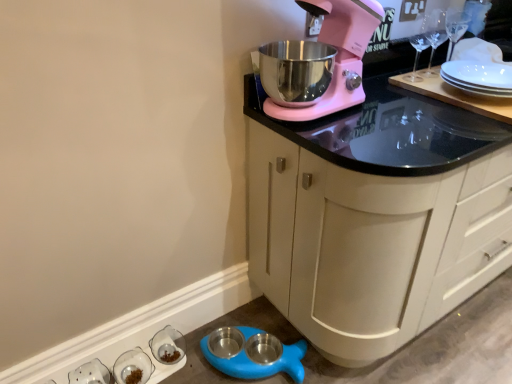
Describe the element at coordinates (90, 373) in the screenshot. I see `white glossy salt and pepper shakers at lower left, acting as the 3th tableware starting from the right` at that location.

Identify the location of matte white cabinet at upper right. The width and height of the screenshot is (512, 384). (375, 217).

You are a GUI agent. You are given a task and a screenshot of the screen. Output one action in this format:
    pyautogui.click(x=<x>, y=<y>)
    Task: Click on the pink matte mixer at upper right
    
    Given the screenshot: What is the action you would take?
    pyautogui.click(x=337, y=56)

What is the approximate width of pink matte mixer at upper right?

The width of pink matte mixer at upper right is 16.74 inches.

Describe the element at coordinates (133, 367) in the screenshot. This screenshot has height=384, width=512. I see `clear glass bowls at lower left, marked as the 2th tableware in a right-to-left arrangement` at that location.

Measure the distance between point [289,356] and camera.

They are 4.95 feet apart.

Image resolution: width=512 pixels, height=384 pixels. Describe the element at coordinates (168, 345) in the screenshot. I see `clear glass bowl at lower left, the 1th tableware viewed from the right` at that location.

Where is `white glossy salt and pepper shakers at lower left, acting as the 3th tableware starting from the right`? Image resolution: width=512 pixels, height=384 pixels. white glossy salt and pepper shakers at lower left, acting as the 3th tableware starting from the right is located at coordinates (90, 373).

Considering the sizes of objects pink matte mixer at upper right and white glossy salt and pepper shakers at lower left, which ranks as the 1th tableware in left-to-right order, in the image provided, who is shorter, pink matte mixer at upper right or white glossy salt and pepper shakers at lower left, which ranks as the 1th tableware in left-to-right order,?

With less height is white glossy salt and pepper shakers at lower left, which ranks as the 1th tableware in left-to-right order.

From the image's perspective, count 3rd tablewares downward from the pink matte mixer at upper right and point to it. Please provide its 2D coordinates.

[(90, 373)]

Which is farther, [345,29] or [90,370]?

Positioned behind is point [90,370].

From a real-world perspective, between pink matte mixer at upper right and white glossy salt and pepper shakers at lower left, acting as the 3th tableware starting from the right, who is vertically higher?

pink matte mixer at upper right.

From a real-world perspective, is white glossy salt and pepper shakers at lower left, which ranks as the 1th tableware in left-to-right order, positioned above or below clear glass bowls at lower left, the 2th tableware when ordered from left to right?

Clearly, from a real-world perspective, white glossy salt and pepper shakers at lower left, which ranks as the 1th tableware in left-to-right order, is above clear glass bowls at lower left, the 2th tableware when ordered from left to right.

Could you tell me if white glossy salt and pepper shakers at lower left, acting as the 3th tableware starting from the right, is turned towards clear glass bowls at lower left, marked as the 2th tableware in a right-to-left arrangement?

No, white glossy salt and pepper shakers at lower left, acting as the 3th tableware starting from the right, is not facing towards clear glass bowls at lower left, marked as the 2th tableware in a right-to-left arrangement.

Is white glossy salt and pepper shakers at lower left, which ranks as the 1th tableware in left-to-right order, bigger or smaller than clear glass bowls at lower left, the 2th tableware when ordered from left to right?

Clearly, white glossy salt and pepper shakers at lower left, which ranks as the 1th tableware in left-to-right order, is larger in size than clear glass bowls at lower left, the 2th tableware when ordered from left to right.

Identify the location of tableware that appears below the clear glass bowls at lower left, marked as the 2th tableware in a right-to-left arrangement (from the image's perspective). The height and width of the screenshot is (384, 512). (90, 373).

Is clear glass bowls at lower left, the 2th tableware when ordered from left to right, to the left or to the right of clear glass bowl at lower left, arranged as the 3th tableware when viewed from the left, in the image?

Based on their positions, clear glass bowls at lower left, the 2th tableware when ordered from left to right, is located to the left of clear glass bowl at lower left, arranged as the 3th tableware when viewed from the left.

Relative to clear glass bowl at lower left, arranged as the 3th tableware when viewed from the left, is clear glass bowls at lower left, marked as the 2th tableware in a right-to-left arrangement, in front or behind?

Visually, clear glass bowls at lower left, marked as the 2th tableware in a right-to-left arrangement, is located in front of clear glass bowl at lower left, arranged as the 3th tableware when viewed from the left.

From a real-world perspective, is clear glass bowls at lower left, marked as the 2th tableware in a right-to-left arrangement, above or below clear glass bowl at lower left, the 1th tableware viewed from the right?

Clearly, from a real-world perspective, clear glass bowls at lower left, marked as the 2th tableware in a right-to-left arrangement, is above clear glass bowl at lower left, the 1th tableware viewed from the right.

Is matte white cabinet at upper right at the back of clear glass bowls at lower left, marked as the 2th tableware in a right-to-left arrangement?

clear glass bowls at lower left, marked as the 2th tableware in a right-to-left arrangement, is not turned away from matte white cabinet at upper right.

Looking at this image, considering the relative sizes of clear glass bowls at lower left, marked as the 2th tableware in a right-to-left arrangement, and matte white cabinet at upper right in the image provided, is clear glass bowls at lower left, marked as the 2th tableware in a right-to-left arrangement, wider than matte white cabinet at upper right?

No.

Is clear glass bowls at lower left, the 2th tableware when ordered from left to right, to the left or to the right of matte white cabinet at upper right in the image?

clear glass bowls at lower left, the 2th tableware when ordered from left to right, is positioned on matte white cabinet at upper right's left side.

Considering the relative sizes of clear glass bowl at lower left, arranged as the 3th tableware when viewed from the left, and matte white cabinet at upper right in the image provided, is clear glass bowl at lower left, arranged as the 3th tableware when viewed from the left, smaller than matte white cabinet at upper right?

Correct, clear glass bowl at lower left, arranged as the 3th tableware when viewed from the left, occupies less space than matte white cabinet at upper right.

In terms of height, does clear glass bowl at lower left, arranged as the 3th tableware when viewed from the left, look taller or shorter compared to matte white cabinet at upper right?

In the image, clear glass bowl at lower left, arranged as the 3th tableware when viewed from the left, appears to be shorter than matte white cabinet at upper right.

From the image's perspective, is clear glass bowl at lower left, arranged as the 3th tableware when viewed from the left, over matte white cabinet at upper right?

No, from the image's perspective, clear glass bowl at lower left, arranged as the 3th tableware when viewed from the left, is not on top of matte white cabinet at upper right.

Visually, is clear glass bowl at lower left, the 1th tableware viewed from the right, positioned to the left or to the right of matte white cabinet at upper right?

clear glass bowl at lower left, the 1th tableware viewed from the right, is to the left of matte white cabinet at upper right.

Are white glossy salt and pepper shakers at lower left, which ranks as the 1th tableware in left-to-right order, and clear glass bowl at lower left, arranged as the 3th tableware when viewed from the left, making contact?

No, white glossy salt and pepper shakers at lower left, which ranks as the 1th tableware in left-to-right order, is not with clear glass bowl at lower left, arranged as the 3th tableware when viewed from the left.

Can you confirm if white glossy salt and pepper shakers at lower left, which ranks as the 1th tableware in left-to-right order, is smaller than clear glass bowl at lower left, the 1th tableware viewed from the right?

Incorrect, white glossy salt and pepper shakers at lower left, which ranks as the 1th tableware in left-to-right order, is not smaller in size than clear glass bowl at lower left, the 1th tableware viewed from the right.

Is white glossy salt and pepper shakers at lower left, acting as the 3th tableware starting from the right, not inside clear glass bowl at lower left, arranged as the 3th tableware when viewed from the left?

white glossy salt and pepper shakers at lower left, acting as the 3th tableware starting from the right, lies outside clear glass bowl at lower left, arranged as the 3th tableware when viewed from the left,'s area.

From a real-world perspective, relative to clear glass bowl at lower left, the 1th tableware viewed from the right, is white glossy salt and pepper shakers at lower left, which ranks as the 1th tableware in left-to-right order, vertically above or below?

In terms of real-world spatial position, white glossy salt and pepper shakers at lower left, which ranks as the 1th tableware in left-to-right order, is above clear glass bowl at lower left, the 1th tableware viewed from the right.

Considering the sizes of matte white cabinet at upper right and white glossy salt and pepper shakers at lower left, acting as the 3th tableware starting from the right, in the image, is matte white cabinet at upper right wider or thinner than white glossy salt and pepper shakers at lower left, acting as the 3th tableware starting from the right,?

Clearly, matte white cabinet at upper right has more width compared to white glossy salt and pepper shakers at lower left, acting as the 3th tableware starting from the right.

From the picture: Between matte white cabinet at upper right and white glossy salt and pepper shakers at lower left, acting as the 3th tableware starting from the right, which one is positioned in front?

matte white cabinet at upper right.

Is matte white cabinet at upper right inside or outside of white glossy salt and pepper shakers at lower left, acting as the 3th tableware starting from the right?

matte white cabinet at upper right lies outside white glossy salt and pepper shakers at lower left, acting as the 3th tableware starting from the right.

From a real-world perspective, starting from the pink matte mixer at upper right, which tableware is the 1st one below it? Please provide its 2D coordinates.

[(90, 373)]

Image resolution: width=512 pixels, height=384 pixels. Find the location of `tableware that is the 1st one when counting backward from the white glossy salt and pepper shakers at lower left, which ranks as the 1th tableware in left-to-right order`. tableware that is the 1st one when counting backward from the white glossy salt and pepper shakers at lower left, which ranks as the 1th tableware in left-to-right order is located at coordinates (133, 367).

Which object lies nearer to the anchor point white glossy salt and pepper shakers at lower left, which ranks as the 1th tableware in left-to-right order, clear glass bowl at lower left, the 1th tableware viewed from the right, or pink matte mixer at upper right?

clear glass bowl at lower left, the 1th tableware viewed from the right, lies closer to white glossy salt and pepper shakers at lower left, which ranks as the 1th tableware in left-to-right order, than the other object.

Which object lies nearer to the anchor point blue rubber pet bowls at lower left, matte white cabinet at upper right or white glossy salt and pepper shakers at lower left, acting as the 3th tableware starting from the right?

Among the two, white glossy salt and pepper shakers at lower left, acting as the 3th tableware starting from the right, is located nearer to blue rubber pet bowls at lower left.

Based on their spatial positions, is clear glass bowl at lower left, arranged as the 3th tableware when viewed from the left, or matte white cabinet at upper right closer to clear glass bowls at lower left, marked as the 2th tableware in a right-to-left arrangement?

Among the two, clear glass bowl at lower left, arranged as the 3th tableware when viewed from the left, is located nearer to clear glass bowls at lower left, marked as the 2th tableware in a right-to-left arrangement.

Which object lies further to the anchor point pink matte mixer at upper right, white glossy salt and pepper shakers at lower left, acting as the 3th tableware starting from the right, or clear glass bowls at lower left, marked as the 2th tableware in a right-to-left arrangement?

Among the two, white glossy salt and pepper shakers at lower left, acting as the 3th tableware starting from the right, is located further to pink matte mixer at upper right.

Which object lies further to the anchor point blue rubber pet bowls at lower left, clear glass bowl at lower left, the 1th tableware viewed from the right, or pink matte mixer at upper right?

pink matte mixer at upper right lies further to blue rubber pet bowls at lower left than the other object.

Estimate the real-world distances between objects in this image. Which object is closer to clear glass bowls at lower left, marked as the 2th tableware in a right-to-left arrangement, matte white cabinet at upper right or pink matte mixer at upper right?

matte white cabinet at upper right is closer to clear glass bowls at lower left, marked as the 2th tableware in a right-to-left arrangement.

Based on their spatial positions, is white glossy salt and pepper shakers at lower left, acting as the 3th tableware starting from the right, or clear glass bowls at lower left, marked as the 2th tableware in a right-to-left arrangement, further from clear glass bowl at lower left, arranged as the 3th tableware when viewed from the left?

white glossy salt and pepper shakers at lower left, acting as the 3th tableware starting from the right.

Consider the image. Based on their spatial positions, is matte white cabinet at upper right or blue rubber pet bowls at lower left closer to clear glass bowl at lower left, arranged as the 3th tableware when viewed from the left?

Among the two, blue rubber pet bowls at lower left is located nearer to clear glass bowl at lower left, arranged as the 3th tableware when viewed from the left.

The width and height of the screenshot is (512, 384). Find the location of `cabinetry that lies between pink matte mixer at upper right and blue rubber pet bowls at lower left from top to bottom`. cabinetry that lies between pink matte mixer at upper right and blue rubber pet bowls at lower left from top to bottom is located at coordinates (375, 217).

This screenshot has height=384, width=512. Find the location of `appliance between pink matte mixer at upper right and clear glass bowls at lower left, marked as the 2th tableware in a right-to-left arrangement, in the vertical direction`. appliance between pink matte mixer at upper right and clear glass bowls at lower left, marked as the 2th tableware in a right-to-left arrangement, in the vertical direction is located at coordinates pos(259,364).

This screenshot has height=384, width=512. I want to click on tableware between pink matte mixer at upper right and clear glass bowls at lower left, the 2th tableware when ordered from left to right, vertically, so click(x=168, y=345).

The width and height of the screenshot is (512, 384). I want to click on cabinetry between pink matte mixer at upper right and clear glass bowls at lower left, marked as the 2th tableware in a right-to-left arrangement, in the up-down direction, so click(x=375, y=217).